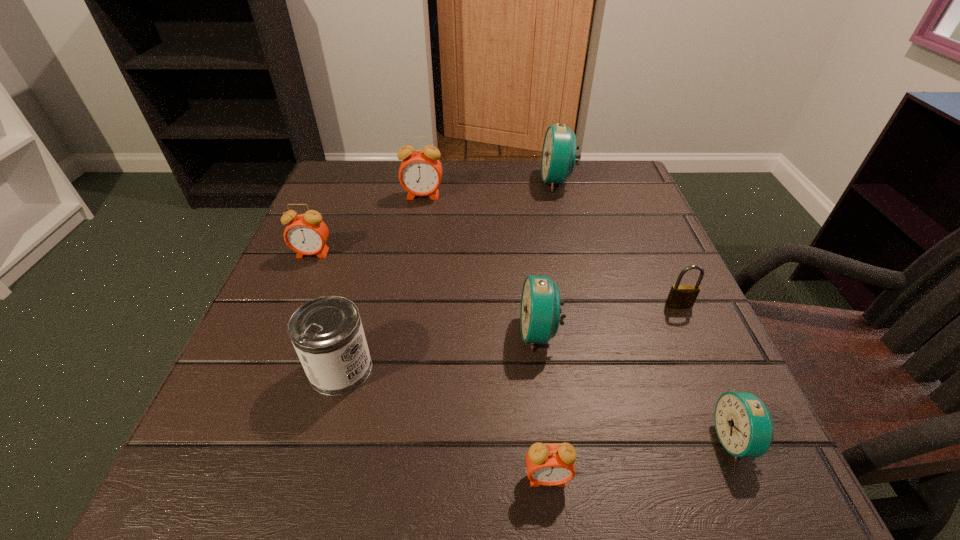
Identify the location of the farthest blue alarm clock. This screenshot has width=960, height=540. (559, 156).

Locate an element on the screen. This screenshot has height=540, width=960. the biggest blue alarm clock is located at coordinates (559, 156).

Locate an element on the screen. Image resolution: width=960 pixels, height=540 pixels. the farthest pink alarm clock is located at coordinates (420, 173).

Where is `the fifth alarm clock from right to left`? The image size is (960, 540). the fifth alarm clock from right to left is located at coordinates (420, 173).

Where is `the second nearest blue alarm clock`? Image resolution: width=960 pixels, height=540 pixels. the second nearest blue alarm clock is located at coordinates (540, 310).

You are a GUI agent. You are given a task and a screenshot of the screen. Output one action in this format:
    pyautogui.click(x=<x>, y=<y>)
    Task: Click on the leftmost blue alarm clock
    This screenshot has width=960, height=540.
    Given the screenshot: What is the action you would take?
    pyautogui.click(x=540, y=310)

Identify the location of the third farthest object. (306, 234).

This screenshot has height=540, width=960. I want to click on the third farthest alarm clock, so click(x=306, y=234).

Where is `can`? can is located at coordinates (327, 334).

The width and height of the screenshot is (960, 540). I want to click on padlock, so click(680, 296).